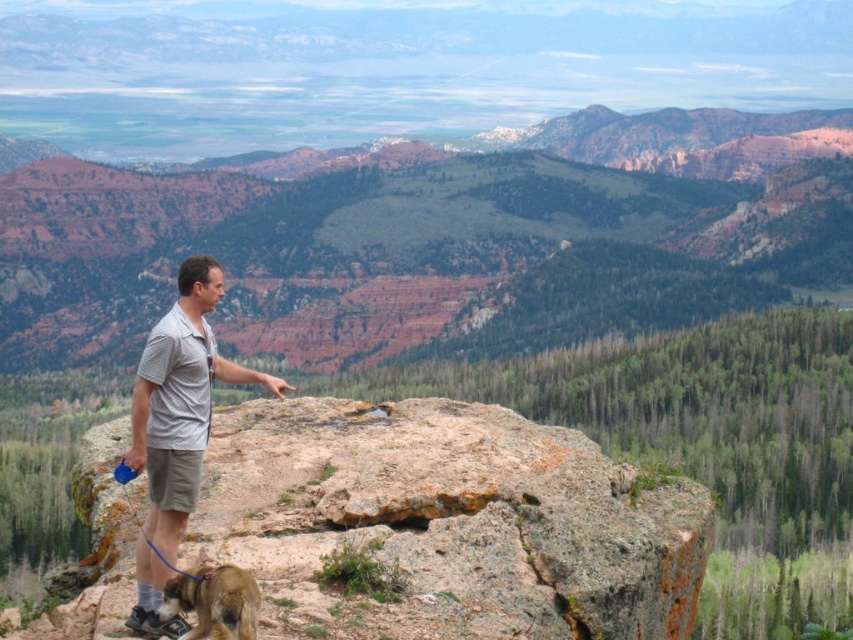
Question: In this image, where is rusty rock at center located relative to light gray cotton shirt at center?

Choices:
 (A) right
 (B) left

Answer: (A)

Question: Can you confirm if rusty rock at center is positioned to the left of brown furry dog at lower left?

Choices:
 (A) no
 (B) yes

Answer: (A)

Question: Which object is positioned closest to the brown furry dog at lower left?

Choices:
 (A) rusty rock at center
 (B) rustic rock formation at center
 (C) light gray cotton shirt at center

Answer: (C)

Question: Can you confirm if rustic rock formation at center is positioned below rusty rock at center?

Choices:
 (A) no
 (B) yes

Answer: (A)

Question: Which object is the closest to the rusty rock at center?

Choices:
 (A) rustic rock formation at center
 (B) brown furry dog at lower left

Answer: (B)

Question: Which object appears farthest from the camera in this image?

Choices:
 (A) rusty rock at center
 (B) rustic rock formation at center
 (C) brown furry dog at lower left
 (D) light gray cotton shirt at center

Answer: (B)